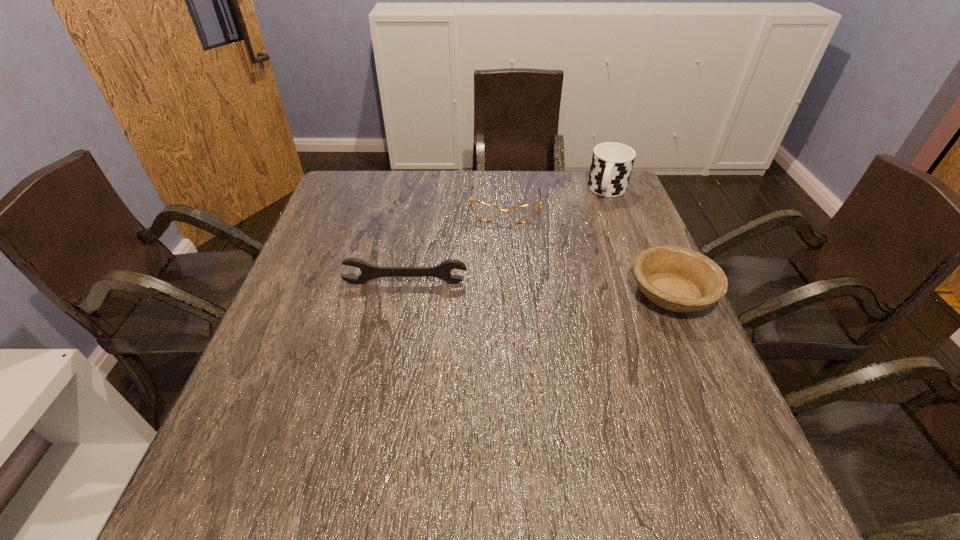
Image resolution: width=960 pixels, height=540 pixels. Identify the location of free space between the spectacles and the wrench. (455, 245).

Find the location of a particular element. empty space that is in between the tallest object and the bowl is located at coordinates (639, 242).

You are a GUI agent. You are given a task and a screenshot of the screen. Output one action in this format:
    pyautogui.click(x=<x>, y=<y>)
    Task: Click on the vacant space in between the bowl and the spectacles
    The image size is (960, 540).
    Given the screenshot: What is the action you would take?
    pyautogui.click(x=588, y=249)

At what (x,y) coordinates should I click in order to perform the action: click on unoccupied area between the spectacles and the cup. Please return your answer as a coordinate pair (x, y). Looking at the image, I should click on (557, 198).

Locate which object is the third closest to the spectacles. Please provide its 2D coordinates. Your answer should be formatted as a tuple, i.e. [(x, y)], where the tuple contains the x and y coordinates of a point satisfying the conditions above.

[(675, 278)]

Choose which object is the third nearest neighbor to the wrench. Please provide its 2D coordinates. Your answer should be formatted as a tuple, i.e. [(x, y)], where the tuple contains the x and y coordinates of a point satisfying the conditions above.

[(612, 163)]

Where is `vacant area that satisfies the following two spatial constraints: 1. on the open ends of the bowl; 2. on the left side of the wrench`? vacant area that satisfies the following two spatial constraints: 1. on the open ends of the bowl; 2. on the left side of the wrench is located at coordinates (403, 293).

At what (x,y) coordinates should I click in order to perform the action: click on vacant area in the image that satisfies the following two spatial constraints: 1. on the front side of the bowl; 2. on the left side of the spectacles. Please return your answer as a coordinate pair (x, y). Looking at the image, I should click on (512, 293).

Locate an element on the screen. Image resolution: width=960 pixels, height=540 pixels. free location that satisfies the following two spatial constraints: 1. on the open ends of the bowl; 2. on the left side of the wrench is located at coordinates (403, 293).

Identify the location of blank space that satisfies the following two spatial constraints: 1. on the open ends of the bowl; 2. on the left side of the wrench. (403, 293).